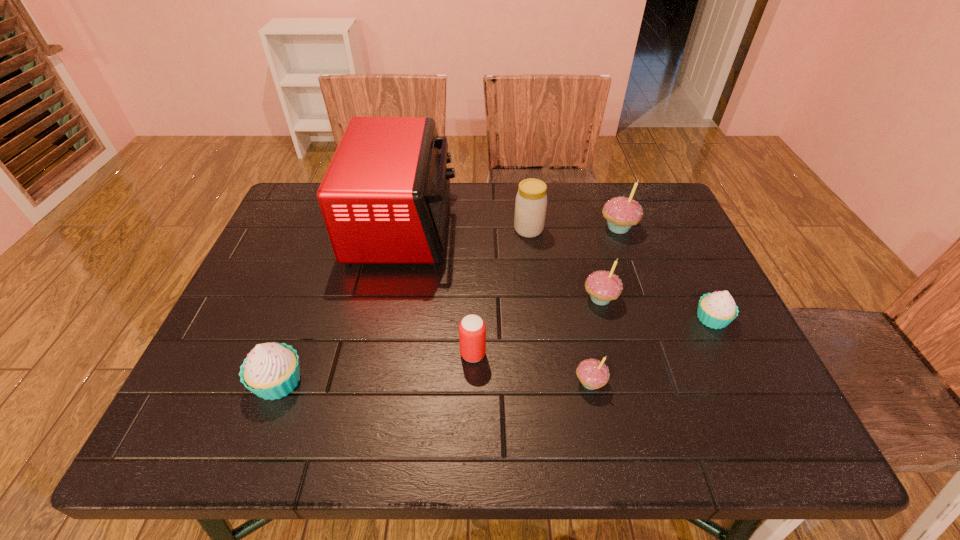
Where is `free space that satisfies the following two spatial constraints: 1. on the front side of the fourth object from left to right; 2. on the right side of the second biggest pink cupcake`? This screenshot has height=540, width=960. free space that satisfies the following two spatial constraints: 1. on the front side of the fourth object from left to right; 2. on the right side of the second biggest pink cupcake is located at coordinates (537, 299).

At what (x,y) coordinates should I click in order to perform the action: click on free location that satisfies the following two spatial constraints: 1. on the front-facing side of the red toaster oven; 2. on the back side of the fifth object from right to left. Please return your answer as a coordinate pair (x, y). Image resolution: width=960 pixels, height=540 pixels. Looking at the image, I should click on (402, 230).

This screenshot has height=540, width=960. I want to click on free space in the image that satisfies the following two spatial constraints: 1. on the front-facing side of the red toaster oven; 2. on the back side of the fourth object from left to right, so click(x=402, y=230).

In order to click on vacant space that satisfies the following two spatial constraints: 1. on the front side of the smallest pink cupcake; 2. on the left side of the leftmost cupcake in this screenshot , I will do `click(278, 383)`.